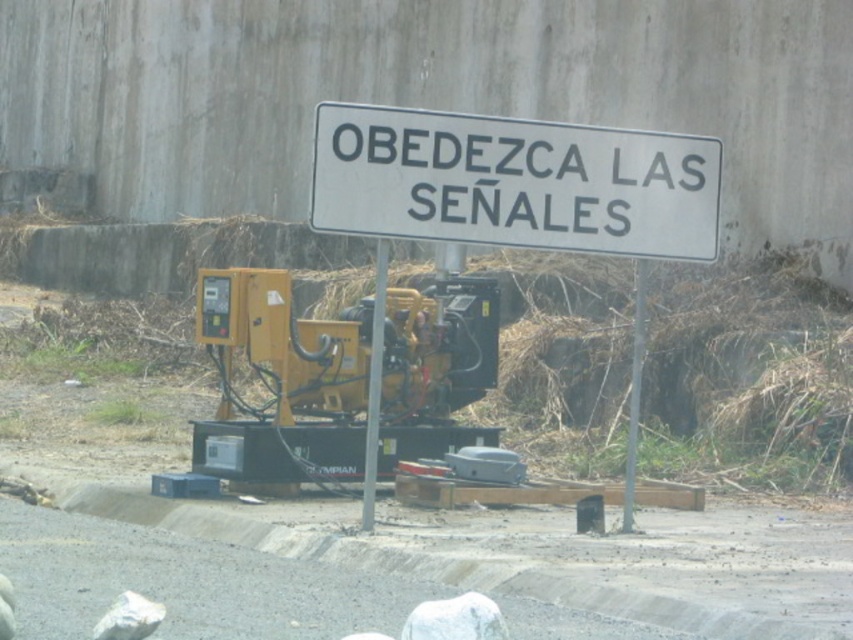
You are standing in front of the generator and want to locate the white plastic sign at upper center. According to the scene description, where should you look relative to the generator?

The white plastic sign at upper center is located behind the generator, as it is mentioned to be mounted on two vertical metal poles in front of which the generator is placed.

You are a technician standing 15 meters away from the signboard. You need to inspect the yellow metallic generator at center. Can you reach the generator without moving closer than your current position?

The yellow metallic generator at center is 12.45 meters away from the camera. Since you are currently 15 meters away from the signboard, which is in front of the generator, you would need to move closer to reach the generator. Therefore, you cannot reach it without moving closer than your current position.

Consider the image. You are a maintenance worker inspecting the equipment area. You see the white plastic sign at upper center and the metallic pole at center. Which object is shorter?

The white plastic sign at upper center has a lesser height compared to the metallic pole at center, so the white plastic sign at upper center is shorter.